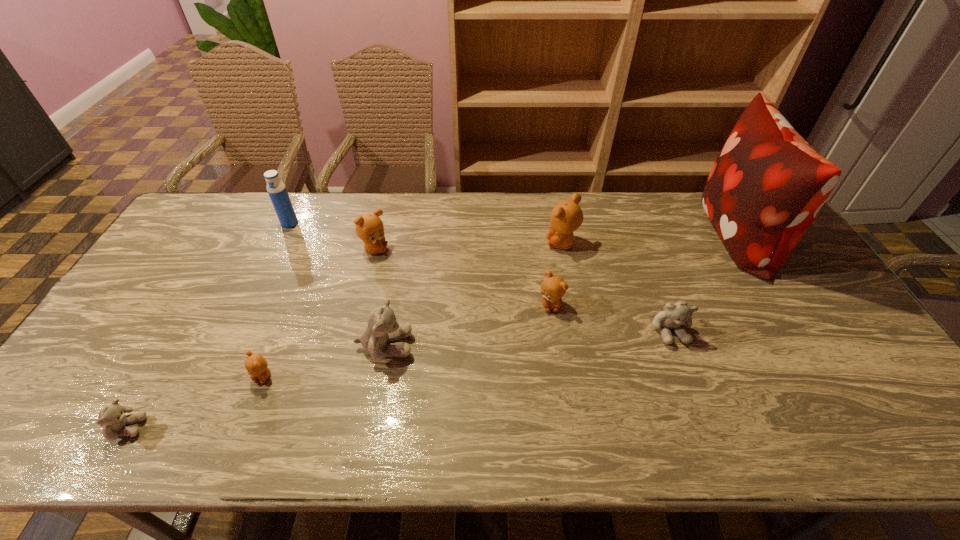
At what (x,y) coordinates should I click in order to perform the action: click on vacant region located on the face of the tallest teddy bear. Please return your answer as a coordinate pair (x, y). This screenshot has width=960, height=540. Looking at the image, I should click on (500, 244).

At what (x,y) coordinates should I click in order to perform the action: click on free space located 0.190m on the face of the third smallest brown teddy bear. Please return your answer as a coordinate pair (x, y). Looking at the image, I should click on (447, 250).

Find the location of a particular element. This screenshot has width=960, height=540. vacant area situated on the face of the second gray teddy bear from right to left is located at coordinates (463, 346).

At what (x,y) coordinates should I click in order to perform the action: click on vacant space located on the face of the second nearest brown teddy bear. Please return your answer as a coordinate pair (x, y). This screenshot has height=540, width=960. Looking at the image, I should click on (565, 411).

The width and height of the screenshot is (960, 540). I want to click on free space located 0.110m on the face of the rightmost teddy bear, so click(x=690, y=386).

Identify the location of vacant space positioned on the face of the second teddy bear from left to right. This screenshot has width=960, height=540. (241, 433).

The image size is (960, 540). In order to click on free spot located on the face of the smallest gray teddy bear in this screenshot , I will do `click(260, 427)`.

Identify the location of cushion at the far edge. This screenshot has height=540, width=960. (765, 189).

At what (x,y) coordinates should I click in order to perform the action: click on water bottle situated at the far edge. Please return your answer as a coordinate pair (x, y). This screenshot has height=540, width=960. Looking at the image, I should click on (276, 189).

The width and height of the screenshot is (960, 540). I want to click on teddy bear that is at the far edge, so click(x=566, y=217).